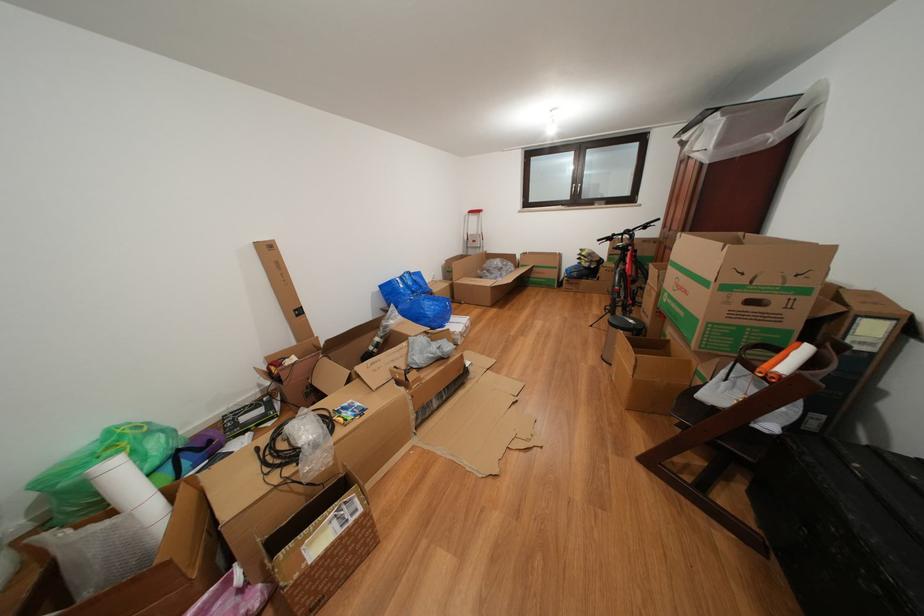
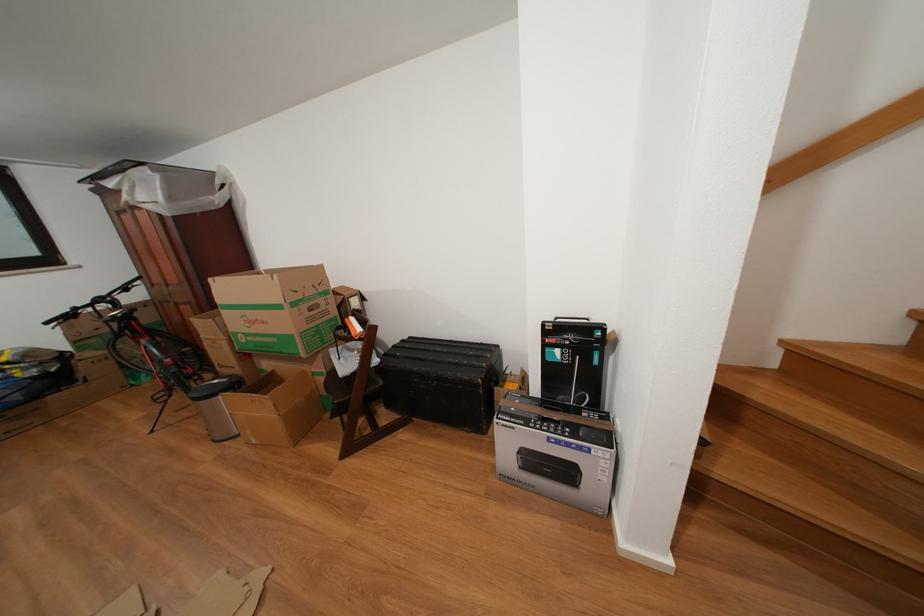
The images are taken continuously from a first-person perspective. In which direction is your viewpoint rotating?

The camera's rotation is toward right-down.